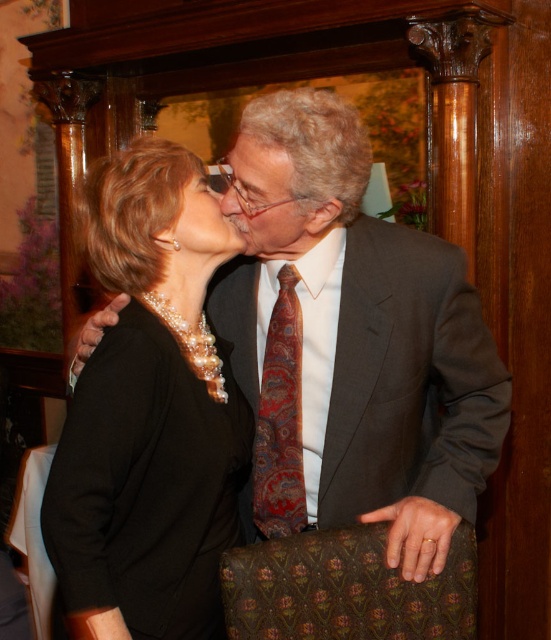
Is black satin dress at center to the left of matte black face at center from the viewer's perspective?

Correct, you'll find black satin dress at center to the left of matte black face at center.

Which of these two, black satin dress at center or matte black face at center, stands shorter?

With less height is matte black face at center.

This screenshot has width=551, height=640. Find the location of `black satin dress at center`. black satin dress at center is located at coordinates (149, 412).

From the picture: Can you confirm if dark gray wool suit at center is positioned to the left of paisley-patterned silk tie at center?

Incorrect, dark gray wool suit at center is not on the left side of paisley-patterned silk tie at center.

Between dark gray wool suit at center and paisley-patterned silk tie at center, which one appears on the left side from the viewer's perspective?

Positioned to the left is paisley-patterned silk tie at center.

Where is `dark gray wool suit at center`? The width and height of the screenshot is (551, 640). dark gray wool suit at center is located at coordinates (406, 380).

Consider the image. Can you confirm if paisley silk tie at center is positioned to the right of matte black face at center?

Correct, you'll find paisley silk tie at center to the right of matte black face at center.

Does paisley silk tie at center have a smaller size compared to matte black face at center?

Actually, paisley silk tie at center might be larger than matte black face at center.

Which is behind, point (266, 156) or point (207, 195)?

Point (207, 195)

Where is `paisley silk tie at center`? The image size is (551, 640). paisley silk tie at center is located at coordinates (267, 202).